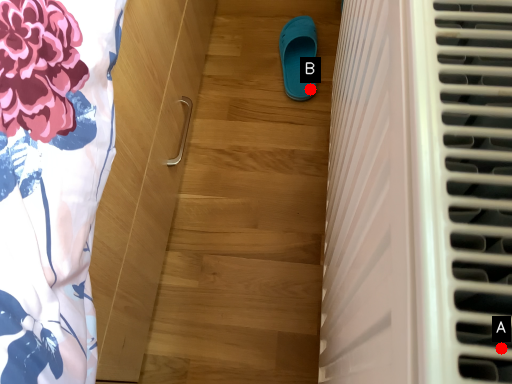
Question: Two points are circled on the image, labeled by A and B beside each circle. Which point is farther to the camera?

Choices:
 (A) A is further
 (B) B is further

Answer: (B)